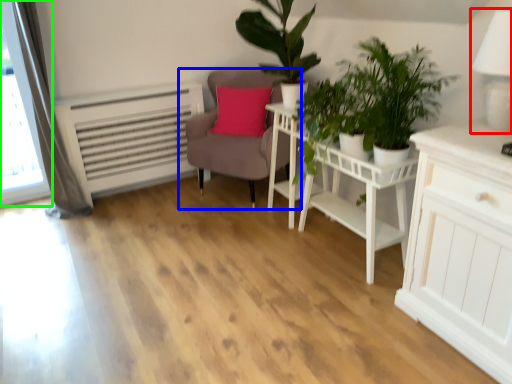
Question: Estimate the real-world distances between objects in this image. Which object is closer to table lamp (highlighted by a red box), chair (highlighted by a blue box) or window (highlighted by a green box)?

Choices:
 (A) chair
 (B) window

Answer: (A)